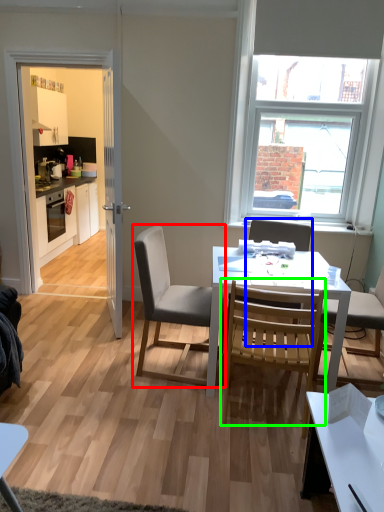
Question: Which object is positioned farthest from chair (highlighted by a red box)? Select from chair (highlighted by a blue box) and chair (highlighted by a green box).

Choices:
 (A) chair
 (B) chair

Answer: (A)